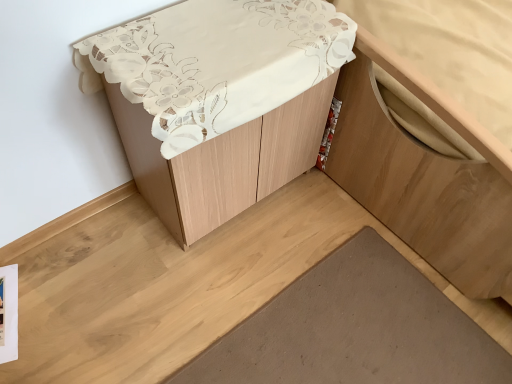
At what (x,y) coordinates should I click in order to perform the action: click on empty space that is ontop of matte white cabinet at center (from a real-world perspective). Please return your answer as a coordinate pair (x, y). Looking at the image, I should click on 224,38.